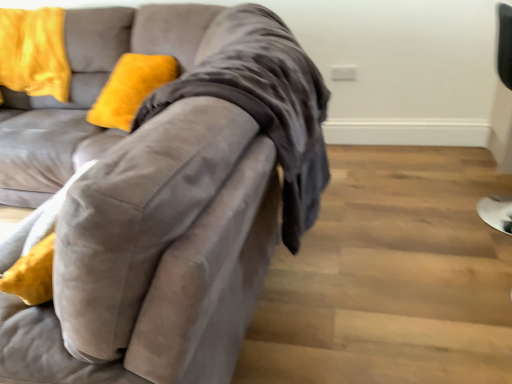
Where is `free area behind black leather chair at right`? free area behind black leather chair at right is located at coordinates (450, 182).